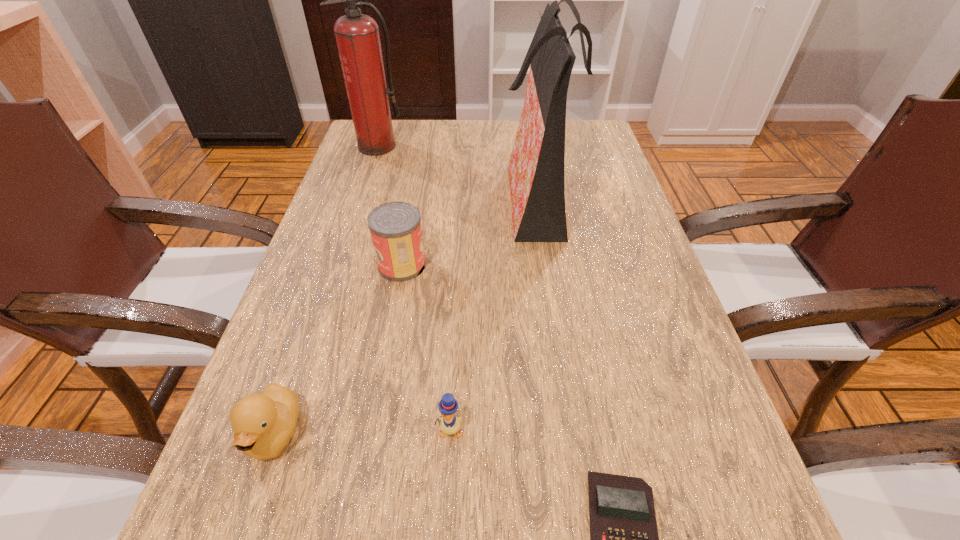
The image size is (960, 540). In order to click on vacant space located 0.050m on the front side of the fifth nearest object in this screenshot , I will do `click(482, 195)`.

Find the location of `free space located 0.060m at the nozzle of the farthest object`. free space located 0.060m at the nozzle of the farthest object is located at coordinates (371, 167).

Image resolution: width=960 pixels, height=540 pixels. I want to click on vacant area located on the back of the can, so click(418, 176).

I want to click on blank area located facing forward on the taller duckling, so click(x=240, y=537).

Image resolution: width=960 pixels, height=540 pixels. I want to click on free spot located 0.070m on the face of the second shortest object, where the monocle is placed, so click(446, 491).

At what (x,y) coordinates should I click in order to perform the action: click on shopping bag that is at the far edge. Please return your answer as a coordinate pair (x, y). This screenshot has height=540, width=960. Looking at the image, I should click on (536, 167).

Identify the location of fire extinguisher situated at the far edge. Image resolution: width=960 pixels, height=540 pixels. (357, 35).

Find the location of a particular element. fire extinguisher at the left edge is located at coordinates (357, 35).

Where is `can that is positioned at the left edge`? can that is positioned at the left edge is located at coordinates (395, 227).

Identify the location of duckling present at the left edge. (263, 424).